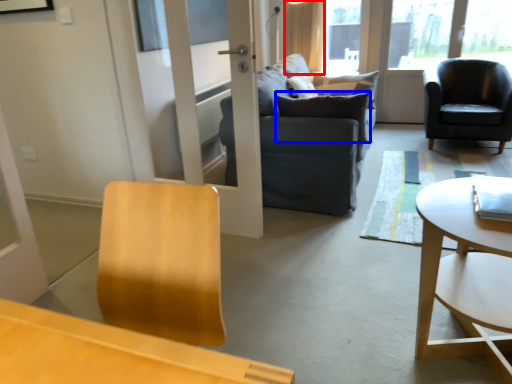
Question: Which point is closer to the camera, curtain (highlighted by a red box) or pillow (highlighted by a blue box)?

Choices:
 (A) curtain
 (B) pillow

Answer: (B)